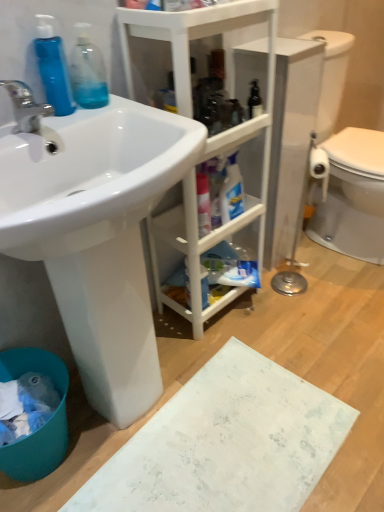
Question: Can you confirm if blue plastic bottle at left, the first cleaning product when ordered from left to right, is thinner than white glossy sink at upper left?

Choices:
 (A) yes
 (B) no

Answer: (A)

Question: From the image's perspective, is blue plastic bottle at left, the first cleaning product when ordered from left to right, over white glossy sink at upper left?

Choices:
 (A) yes
 (B) no

Answer: (A)

Question: From a real-world perspective, does blue plastic bottle at left, the first cleaning product when ordered from left to right, sit lower than white glossy sink at upper left?

Choices:
 (A) no
 (B) yes

Answer: (A)

Question: Is blue plastic bottle at left, which appears as the second cleaning product when viewed from the right, wider than white glossy sink at upper left?

Choices:
 (A) no
 (B) yes

Answer: (A)

Question: Is blue plastic bottle at left, which appears as the second cleaning product when viewed from the right, closer to the viewer compared to white glossy sink at upper left?

Choices:
 (A) no
 (B) yes

Answer: (A)

Question: Is the position of blue plastic bottle at left, which appears as the second cleaning product when viewed from the right, more distant than that of white glossy sink at upper left?

Choices:
 (A) no
 (B) yes

Answer: (B)

Question: Is matte silver faucet at left bigger than white matte cabinet at center?

Choices:
 (A) yes
 (B) no

Answer: (B)

Question: Is matte silver faucet at left not within white matte cabinet at center?

Choices:
 (A) no
 (B) yes

Answer: (B)

Question: Is matte silver faucet at left at the left side of white matte cabinet at center?

Choices:
 (A) no
 (B) yes

Answer: (B)

Question: Considering the relative sizes of matte silver faucet at left and white matte cabinet at center in the image provided, is matte silver faucet at left shorter than white matte cabinet at center?

Choices:
 (A) no
 (B) yes

Answer: (B)

Question: Is matte silver faucet at left smaller than white matte cabinet at center?

Choices:
 (A) no
 (B) yes

Answer: (B)

Question: Is matte silver faucet at left closer to the viewer compared to white matte cabinet at center?

Choices:
 (A) no
 (B) yes

Answer: (B)

Question: Could you tell me if white matte cabinet at center is facing matte silver faucet at left?

Choices:
 (A) no
 (B) yes

Answer: (A)